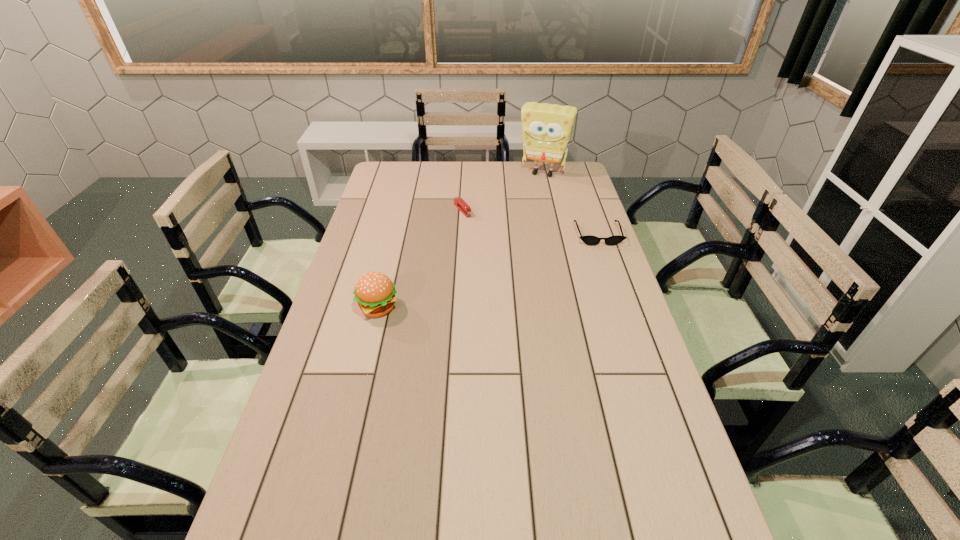
Where is `vacant space located on the face of the sponge`? This screenshot has height=540, width=960. vacant space located on the face of the sponge is located at coordinates (524, 208).

Image resolution: width=960 pixels, height=540 pixels. I want to click on vacant space located on the face of the sponge, so click(520, 216).

The image size is (960, 540). In order to click on blank space located 0.340m on the front-facing side of the stapler in this screenshot , I will do `click(512, 265)`.

You are a GUI agent. You are given a task and a screenshot of the screen. Output one action in this format:
    pyautogui.click(x=<x>, y=<y>)
    Task: Click on the free space located on the front-facing side of the stapler
    This screenshot has width=960, height=540.
    Given the screenshot: What is the action you would take?
    pyautogui.click(x=509, y=262)

Identify the location of vacant space located 0.210m on the front-facing side of the stapler. Image resolution: width=960 pixels, height=540 pixels. (493, 245).

What are the coordinates of `object at the far edge` in the screenshot? It's located at (547, 128).

In order to click on object situated at the left edge in this screenshot , I will do `click(375, 293)`.

Identify the location of sunglasses positioned at the right edge. (590, 240).

Locate an element on the screen. sponge at the right edge is located at coordinates (547, 128).

Identify the location of object at the far right corner. This screenshot has height=540, width=960. (547, 128).